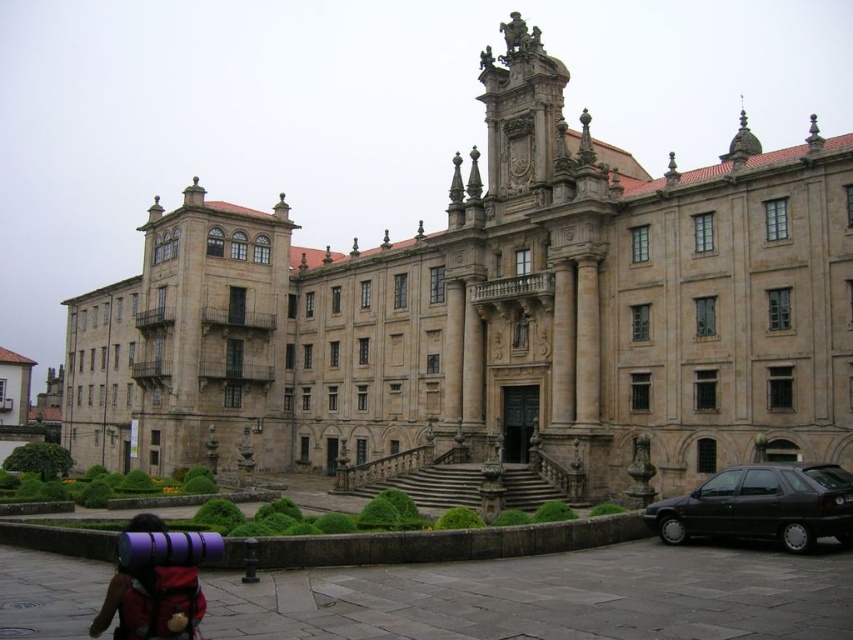
Question: Does beige stone palace at center come behind black matte hatchback at lower right?

Choices:
 (A) yes
 (B) no

Answer: (A)

Question: Can you confirm if black matte hatchback at lower right is positioned to the right of purple fabric backpack at lower left?

Choices:
 (A) no
 (B) yes

Answer: (B)

Question: Which object appears farthest from the camera in this image?

Choices:
 (A) beige stone palace at center
 (B) purple fabric backpack at lower left
 (C) black matte hatchback at lower right

Answer: (A)

Question: Among these objects, which one is nearest to the camera?

Choices:
 (A) purple fabric backpack at lower left
 (B) black matte hatchback at lower right

Answer: (A)

Question: Which point is closer to the camera?

Choices:
 (A) black matte hatchback at lower right
 (B) purple fabric backpack at lower left

Answer: (B)

Question: Can you confirm if black matte hatchback at lower right is smaller than purple fabric backpack at lower left?

Choices:
 (A) yes
 (B) no

Answer: (A)